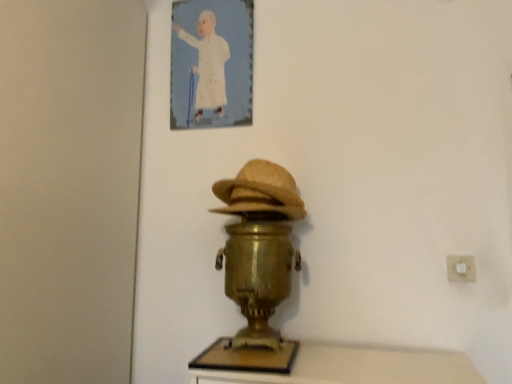
You are a GUI agent. You are given a task and a screenshot of the screen. Output one action in this format:
    pyautogui.click(x=<x>, y=<y>)
    Task: Click on the gold metallic samovar at center
    The height and width of the screenshot is (384, 512).
    Given the screenshot: What is the action you would take?
    pyautogui.click(x=257, y=266)

Describe the element at coordinates (257, 266) in the screenshot. I see `gold metallic samovar at center` at that location.

Describe the element at coordinates (260, 193) in the screenshot. This screenshot has height=384, width=512. I see `bleached straw hat at center` at that location.

What do you see at coordinates (461, 268) in the screenshot? I see `white plastic electric outlet at lower right` at bounding box center [461, 268].

The width and height of the screenshot is (512, 384). What are the coordinates of `gold metallic samovar at center` in the screenshot? It's located at (257, 266).

You are a GUI agent. You are given a task and a screenshot of the screen. Output one action in this format:
    pyautogui.click(x=<x>, y=<y>)
    Task: Click on the hat below the white paper at upper center (from a real-world perspective)
    
    Given the screenshot: What is the action you would take?
    pyautogui.click(x=260, y=193)

Consider the image. Is bleached straw hat at center to the right of white paper at upper center from the viewer's perspective?

Correct, you'll find bleached straw hat at center to the right of white paper at upper center.

Is bleached straw hat at center situated inside white paper at upper center or outside?

The correct answer is: outside.

Does bleached straw hat at center turn towards white paper at upper center?

No.

From a real-world perspective, which object stands above the other?

white plastic electric outlet at lower right.

Does white plastic electric outlet at lower right have a lesser width compared to gold metallic samovar at center?

Yes, white plastic electric outlet at lower right is thinner than gold metallic samovar at center.

Based on the photo, is the surface of white plastic electric outlet at lower right in direct contact with gold metallic samovar at center?

No, white plastic electric outlet at lower right is not making contact with gold metallic samovar at center.

From the image's perspective, between white plastic electric outlet at lower right and gold metallic samovar at center, who is located below?

gold metallic samovar at center.

Is gold metallic samovar at center far from white paper at upper center?

No, gold metallic samovar at center is not far away from white paper at upper center.

Is gold metallic samovar at center bigger than white paper at upper center?

Correct, gold metallic samovar at center is larger in size than white paper at upper center.

Would you say gold metallic samovar at center is inside or outside white paper at upper center?

gold metallic samovar at center is not inside white paper at upper center, it's outside.

Considering the relative sizes of gold metallic samovar at center and white paper at upper center in the image provided, is gold metallic samovar at center wider than white paper at upper center?

Correct, the width of gold metallic samovar at center exceeds that of white paper at upper center.

Which object is positioned more to the right, white paper at upper center or bleached straw hat at center?

From the viewer's perspective, bleached straw hat at center appears more on the right side.

Is white paper at upper center far from bleached straw hat at center?

white paper at upper center is near bleached straw hat at center, not far away.

At what (x,y) coordinates should I click in order to perform the action: click on hat to the right of white paper at upper center. Please return your answer as a coordinate pair (x, y). This screenshot has width=512, height=384. Looking at the image, I should click on (260, 193).

Is white paper at upper center closer to the viewer compared to bleached straw hat at center?

No, the depth of white paper at upper center is greater than that of bleached straw hat at center.

Considering their positions, is bleached straw hat at center located in front of or behind gold metallic samovar at center?

In the image, bleached straw hat at center appears behind gold metallic samovar at center.

Is bleached straw hat at center beside gold metallic samovar at center?

No, bleached straw hat at center is not with gold metallic samovar at center.

Is bleached straw hat at center turned away from gold metallic samovar at center?

bleached straw hat at center does not have its back to gold metallic samovar at center.

Is bleached straw hat at center situated inside gold metallic samovar at center or outside?

The correct answer is: inside.

From the image's perspective, who appears lower, white plastic electric outlet at lower right or white paper at upper center?

white plastic electric outlet at lower right, from the image's perspective.

Considering the relative positions of white plastic electric outlet at lower right and white paper at upper center in the image provided, is white plastic electric outlet at lower right in front of white paper at upper center?

Yes, it is in front of white paper at upper center.

Is white plastic electric outlet at lower right next to white paper at upper center?

white plastic electric outlet at lower right and white paper at upper center are not in contact.

Is bleached straw hat at center thinner than white plastic electric outlet at lower right?

Incorrect, the width of bleached straw hat at center is not less than that of white plastic electric outlet at lower right.

Considering the positions of objects bleached straw hat at center and white plastic electric outlet at lower right in the image provided, who is more to the left, bleached straw hat at center or white plastic electric outlet at lower right?

bleached straw hat at center is more to the left.

Image resolution: width=512 pixels, height=384 pixels. In the image, there is a bleached straw hat at center. Find the location of `electric outlet below it (from a real-world perspective)`. electric outlet below it (from a real-world perspective) is located at coordinates (461, 268).

At what (x,y) coordinates should I click in order to perform the action: click on person above the bleached straw hat at center (from a real-world perspective). Please return your answer as a coordinate pair (x, y). The height and width of the screenshot is (384, 512). Looking at the image, I should click on (208, 63).

Where is `electric outlet behind the gold metallic samovar at center`? This screenshot has width=512, height=384. electric outlet behind the gold metallic samovar at center is located at coordinates (461, 268).

Estimate the real-world distances between objects in this image. Which object is further from bleached straw hat at center, gold metallic samovar at center or white plastic electric outlet at lower right?

Among the two, white plastic electric outlet at lower right is located further to bleached straw hat at center.

Based on their spatial positions, is bleached straw hat at center or gold metallic samovar at center further from white paper at upper center?

gold metallic samovar at center.

Based on their spatial positions, is gold metallic samovar at center or white paper at upper center closer to white plastic electric outlet at lower right?

Among the two, gold metallic samovar at center is located nearer to white plastic electric outlet at lower right.

Estimate the real-world distances between objects in this image. Which object is closer to white plastic electric outlet at lower right, gold metallic samovar at center or bleached straw hat at center?

bleached straw hat at center is closer to white plastic electric outlet at lower right.

Estimate the real-world distances between objects in this image. Which object is closer to bleached straw hat at center, white plastic electric outlet at lower right or gold metallic samovar at center?

gold metallic samovar at center is closer to bleached straw hat at center.

From the image, which object appears to be farther from white paper at upper center, gold metallic samovar at center or bleached straw hat at center?

gold metallic samovar at center is further to white paper at upper center.

From the image, which object appears to be nearer to gold metallic samovar at center, white paper at upper center or white plastic electric outlet at lower right?

white paper at upper center lies closer to gold metallic samovar at center than the other object.

Which object lies nearer to the anchor point white paper at upper center, white plastic electric outlet at lower right or gold metallic samovar at center?

gold metallic samovar at center is positioned closer to the anchor white paper at upper center.

Locate an element on the screen. This screenshot has width=512, height=384. hat that lies between white paper at upper center and gold metallic samovar at center from top to bottom is located at coordinates (260, 193).

At what (x,y) coordinates should I click in order to perform the action: click on hat between gold metallic samovar at center and white plastic electric outlet at lower right from left to right. Please return your answer as a coordinate pair (x, y). This screenshot has height=384, width=512. Looking at the image, I should click on (260, 193).

Identify the location of electric outlet that lies between white paper at upper center and gold metallic samovar at center from top to bottom. (461, 268).

Where is `hat between white paper at upper center and white plastic electric outlet at lower right in the horizontal direction`? This screenshot has height=384, width=512. hat between white paper at upper center and white plastic electric outlet at lower right in the horizontal direction is located at coordinates (260, 193).